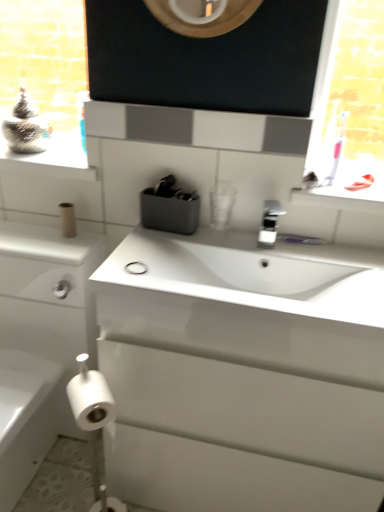
This screenshot has height=512, width=384. What do you see at coordinates (109, 505) in the screenshot?
I see `white matte toilet paper at lower left, the first toilet paper positioned from the bottom` at bounding box center [109, 505].

At what (x,y) coordinates should I click in order to perform the action: click on brown cardboard toilet paper at lower left, the 3th toilet paper ordered from the bottom. Please return your answer as a coordinate pair (x, y). Image resolution: width=384 pixels, height=512 pixels. Looking at the image, I should click on (67, 220).

Identify the location of sink located underneath the metallic silver container at upper left (from a real-world perspective). point(247,275).

Which is behind, point (63, 74) or point (138, 313)?

The point (63, 74) is farther.

Looking at this image, is metallic silver container at upper left turned away from white glossy sink at center?

No, metallic silver container at upper left's orientation is not away from white glossy sink at center.

Would you say metallic silver container at upper left is to the left or to the right of white glossy sink at center in the picture?

Based on their positions, metallic silver container at upper left is located to the left of white glossy sink at center.

Locate an element on the screen. This screenshot has width=384, height=512. tap above the white matte toilet paper at lower left, acting as the third toilet paper starting from the top (from a real-world perspective) is located at coordinates (269, 223).

Which of these two, white matte toilet paper at lower left, acting as the third toilet paper starting from the top, or silver metallic faucet at center, stands shorter?

white matte toilet paper at lower left, acting as the third toilet paper starting from the top.

How many degrees apart are the facing directions of white matte toilet paper at lower left, the first toilet paper positioned from the bottom, and silver metallic faucet at center?

0.645 degrees separate the facing orientations of white matte toilet paper at lower left, the first toilet paper positioned from the bottom, and silver metallic faucet at center.

Consider the image. From a real-world perspective, which object rests below the other?

white matte toilet paper at lower left, which is the second toilet paper in back-to-front order, is physically lower.

Could you tell me if white glossy sink at center is turned towards metallic silver container at upper left?

No, white glossy sink at center is not turned towards metallic silver container at upper left.

Who is shorter, white glossy sink at center or metallic silver container at upper left?

metallic silver container at upper left is shorter.

Is white glossy sink at center smaller than metallic silver container at upper left?

No, white glossy sink at center is not smaller than metallic silver container at upper left.

Measure the distance between white glossy cabinet at left and metallic silver container at upper left.

white glossy cabinet at left and metallic silver container at upper left are 7.41 feet apart from each other.

Which is correct: white glossy cabinet at left is inside metallic silver container at upper left, or outside of it?

white glossy cabinet at left is not enclosed by metallic silver container at upper left.

Does white glossy cabinet at left have a lesser width compared to metallic silver container at upper left?

No, white glossy cabinet at left is not thinner than metallic silver container at upper left.

Can you confirm if white glossy cabinet at left is taller than metallic silver container at upper left?

Yes, white glossy cabinet at left is taller than metallic silver container at upper left.

Consider the image. From a real-world perspective, is brown cardboard toilet paper at lower left, which ranks as the third toilet paper in front-to-back order, below silver metallic faucet at center?

Yes, from a real-world perspective, brown cardboard toilet paper at lower left, which ranks as the third toilet paper in front-to-back order, is below silver metallic faucet at center.

From the picture: How many degrees apart are the facing directions of brown cardboard toilet paper at lower left, which ranks as the third toilet paper in front-to-back order, and silver metallic faucet at center?

They differ by 0.587 degrees in their facing directions.

Is brown cardboard toilet paper at lower left, the 3th toilet paper ordered from the bottom, not inside silver metallic faucet at center?

Indeed, brown cardboard toilet paper at lower left, the 3th toilet paper ordered from the bottom, is completely outside silver metallic faucet at center.

Considering the sizes of objects white glossy window sill at upper right and white matte toilet paper at lower left, which is the 2th toilet paper from front to back, in the image provided, who is shorter, white glossy window sill at upper right or white matte toilet paper at lower left, which is the 2th toilet paper from front to back,?

white glossy window sill at upper right.

Can you confirm if white glossy window sill at upper right is wider than white matte toilet paper at lower left, which is the 2th toilet paper from front to back?

Indeed, white glossy window sill at upper right has a greater width compared to white matte toilet paper at lower left, which is the 2th toilet paper from front to back.

Is white glossy window sill at upper right looking in the opposite direction of white matte toilet paper at lower left, which is the 2th toilet paper from front to back?

No, white glossy window sill at upper right is not facing the opposite direction of white matte toilet paper at lower left, which is the 2th toilet paper from front to back.

From a real-world perspective, does white glossy window sill at upper right stand above white matte toilet paper at lower left, acting as the third toilet paper starting from the top?

Indeed, from a real-world perspective, white glossy window sill at upper right stands above white matte toilet paper at lower left, acting as the third toilet paper starting from the top.

Which is more to the right, white glossy sink at center or brown cardboard toilet paper at lower left, the 3th toilet paper ordered from the bottom?

From the viewer's perspective, white glossy sink at center appears more on the right side.

Which is nearer, [145,297] or [70,220]?

The point [145,297] is in front.

Identify the location of sink directly beneath the brown cardboard toilet paper at lower left, acting as the 1th toilet paper starting from the back (from a real-world perspective). (247, 275).

Is white glossy sink at center not within brown cardboard toilet paper at lower left, which ranks as the third toilet paper in front-to-back order?

white glossy sink at center lies outside brown cardboard toilet paper at lower left, which ranks as the third toilet paper in front-to-back order,'s area.

Image resolution: width=384 pixels, height=512 pixels. I want to click on sink below the metallic silver container at upper left (from the image's perspective), so click(x=247, y=275).

Where is `toilet paper that is the 2nd one when counting leftward from the silver metallic faucet at center`? This screenshot has width=384, height=512. toilet paper that is the 2nd one when counting leftward from the silver metallic faucet at center is located at coordinates (109, 505).

From the image, which object appears to be nearer to brown cardboard toilet paper at lower left, the 3th toilet paper ordered from the bottom, white glossy sink at center or white glossy window sill at upper right?

white glossy sink at center is closer to brown cardboard toilet paper at lower left, the 3th toilet paper ordered from the bottom.

Estimate the real-world distances between objects in this image. Which object is closer to white matte toilet paper at lower left, which is the 2th toilet paper from front to back, white glossy window sill at upper right or brown cardboard toilet paper at lower left, the first toilet paper viewed from the top?

The object closer to white matte toilet paper at lower left, which is the 2th toilet paper from front to back, is brown cardboard toilet paper at lower left, the first toilet paper viewed from the top.

Estimate the real-world distances between objects in this image. Which object is closer to white glossy cabinet at left, metallic silver container at upper left or white glossy sink at center?

white glossy sink at center is positioned closer to the anchor white glossy cabinet at left.

Which object lies nearer to the anchor point brown cardboard toilet paper at lower left, acting as the 1th toilet paper starting from the back, metallic silver container at upper left or silver metallic faucet at center?

silver metallic faucet at center is positioned closer to the anchor brown cardboard toilet paper at lower left, acting as the 1th toilet paper starting from the back.

From the image, which object appears to be farther from white matte toilet paper at lower left, placed as the 3th toilet paper when sorted from back to front, white glossy sink at center or white glossy sink at center?

white glossy sink at center is further to white matte toilet paper at lower left, placed as the 3th toilet paper when sorted from back to front.

When comparing their distances from white glossy sink at center, does white glossy sink at center or brown cardboard toilet paper at lower left, which ranks as the third toilet paper in front-to-back order, seem closer?

The object closer to white glossy sink at center is white glossy sink at center.

Based on their spatial positions, is white glossy window sill at upper right or brown cardboard toilet paper at lower left, the 3th toilet paper ordered from the bottom, closer to white glossy sink at center?

Based on the image, white glossy window sill at upper right appears to be nearer to white glossy sink at center.

Estimate the real-world distances between objects in this image. Which object is closer to white glossy sink at center, metallic silver container at upper left or silver metallic faucet at center?

Based on the image, silver metallic faucet at center appears to be nearer to white glossy sink at center.

Locate an element on the screen. bathroom cabinet between brown cardboard toilet paper at lower left, the 3th toilet paper ordered from the bottom, and white matte toilet paper at lower left, acting as the third toilet paper starting from the top, in the vertical direction is located at coordinates (43, 333).

Identify the location of bathroom cabinet between metallic silver container at upper left and white matte toilet paper at lower left, which is counted as the 1th toilet paper, starting from the front, in the up-down direction. (43, 333).

What are the coordinates of `sink between brown cardboard toilet paper at lower left, the first toilet paper viewed from the top, and white matte toilet paper at lower left, which is the second toilet paper in back-to-front order, vertically` in the screenshot? It's located at (247, 275).

Identify the location of tap between white matte toilet paper at lower left, acting as the 2th toilet paper starting from the bottom, and white glossy window sill at upper right, in the horizontal direction. (269, 223).